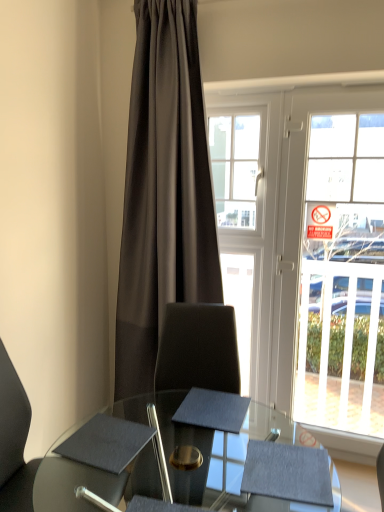
Question: Are clear glass bay window at center and dark gray fabric curtain at center located far from each other?

Choices:
 (A) yes
 (B) no

Answer: (B)

Question: Does clear glass bay window at center have a lesser width compared to dark gray fabric curtain at center?

Choices:
 (A) no
 (B) yes

Answer: (B)

Question: Does clear glass bay window at center have a smaller size compared to dark gray fabric curtain at center?

Choices:
 (A) yes
 (B) no

Answer: (A)

Question: Is clear glass bay window at center looking in the opposite direction of dark gray fabric curtain at center?

Choices:
 (A) yes
 (B) no

Answer: (B)

Question: From a real-world perspective, is clear glass bay window at center physically below dark gray fabric curtain at center?

Choices:
 (A) no
 (B) yes

Answer: (A)

Question: Considering the positions of matte black notepad at center, placed as the 2th notepad when sorted from left to right, and matte black chair at lower left in the image, is matte black notepad at center, placed as the 2th notepad when sorted from left to right, taller or shorter than matte black chair at lower left?

Choices:
 (A) tall
 (B) short

Answer: (B)

Question: Looking at the image, does matte black notepad at center, placed as the 2th notepad when sorted from left to right, seem bigger or smaller compared to matte black chair at lower left?

Choices:
 (A) small
 (B) big

Answer: (A)

Question: From a real-world perspective, is matte black notepad at center, marked as the first notepad in a right-to-left arrangement, positioned above or below matte black chair at lower left?

Choices:
 (A) below
 (B) above

Answer: (B)

Question: Relative to matte black chair at lower left, is matte black notepad at center, placed as the 2th notepad when sorted from left to right, in front or behind?

Choices:
 (A) front
 (B) behind

Answer: (B)

Question: From a real-world perspective, is matte black notepad at center, marked as the first notepad in a right-to-left arrangement, positioned above or below clear glass bay window at center?

Choices:
 (A) above
 (B) below

Answer: (B)

Question: Considering the positions of matte black notepad at center, marked as the first notepad in a right-to-left arrangement, and clear glass bay window at center in the image, is matte black notepad at center, marked as the first notepad in a right-to-left arrangement, wider or thinner than clear glass bay window at center?

Choices:
 (A) wide
 (B) thin

Answer: (A)

Question: In the image, is matte black notepad at center, placed as the 2th notepad when sorted from left to right, positioned in front of or behind clear glass bay window at center?

Choices:
 (A) behind
 (B) front

Answer: (B)

Question: From their relative heights in the image, would you say matte black notepad at center, placed as the 2th notepad when sorted from left to right, is taller or shorter than clear glass bay window at center?

Choices:
 (A) short
 (B) tall

Answer: (A)

Question: Considering the positions of matte black chair at lower left and matte black notepad at center, placed as the 2th notepad when sorted from left to right, in the image, is matte black chair at lower left wider or thinner than matte black notepad at center, placed as the 2th notepad when sorted from left to right,?

Choices:
 (A) wide
 (B) thin

Answer: (A)

Question: Is matte black chair at lower left taller or shorter than matte black notepad at center, marked as the first notepad in a right-to-left arrangement?

Choices:
 (A) tall
 (B) short

Answer: (A)